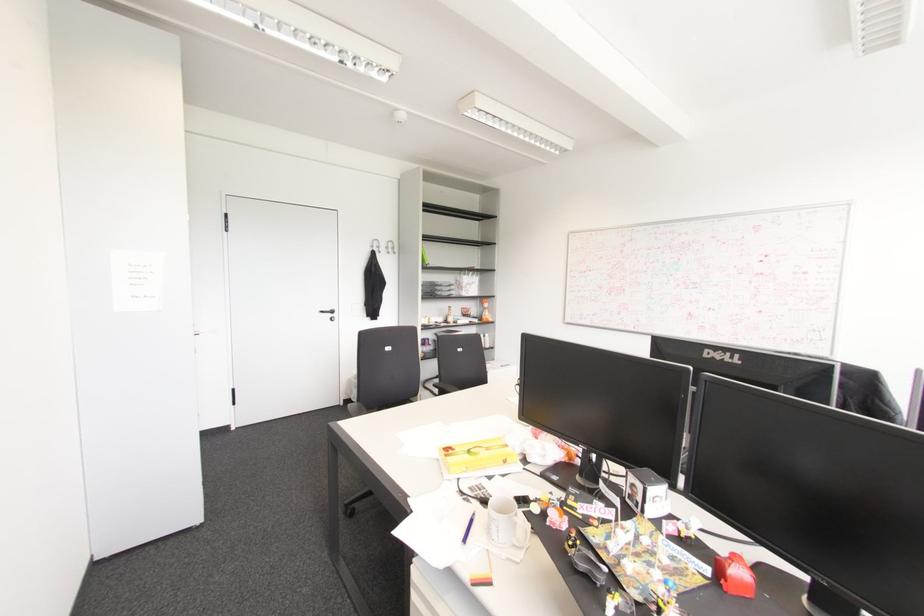
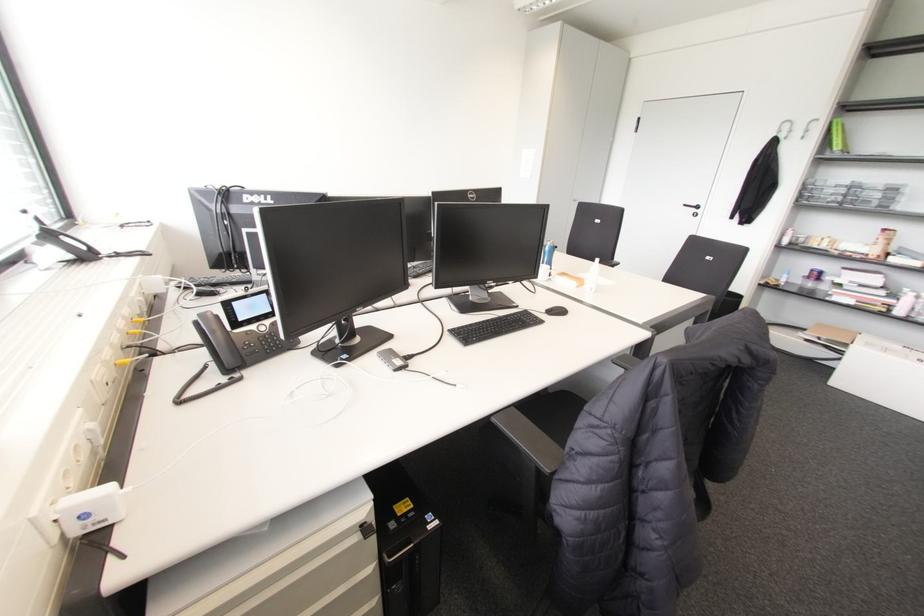
Where in the second image is the point corresponding to [332,310] from the first image?

(697, 207)